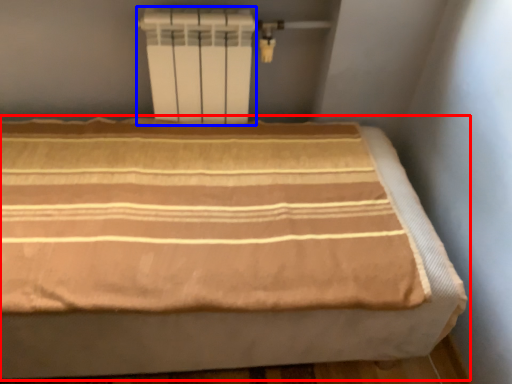
Question: Which object is closer to the camera taking this photo, bed (highlighted by a red box) or water heater (highlighted by a blue box)?

Choices:
 (A) bed
 (B) water heater

Answer: (A)